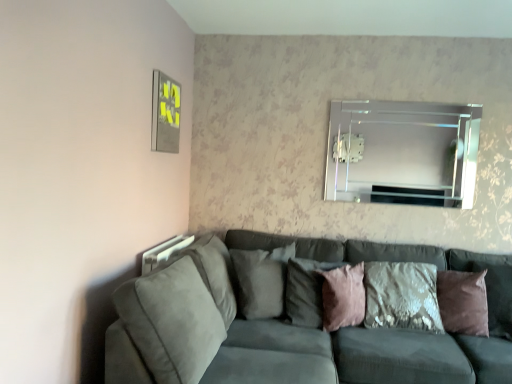
Question: Should I look upward or downward to see clear glass mirror at upper center?

Choices:
 (A) down
 (B) up

Answer: (B)

Question: Is suede gray pillow at center, the first pillow viewed from the left, wider than suede gray couch at lower left?

Choices:
 (A) no
 (B) yes

Answer: (A)

Question: Does suede gray pillow at center, the first pillow viewed from the left, have a smaller size compared to suede gray couch at lower left?

Choices:
 (A) yes
 (B) no

Answer: (A)

Question: From the image's perspective, does suede gray pillow at center, the first pillow viewed from the left, appear higher than suede gray couch at lower left?

Choices:
 (A) yes
 (B) no

Answer: (A)

Question: Is suede gray pillow at center, the fourth pillow positioned from the right, to the right of suede gray couch at lower left from the viewer's perspective?

Choices:
 (A) no
 (B) yes

Answer: (A)

Question: Could you tell me if suede gray pillow at center, the fourth pillow positioned from the right, is facing suede gray couch at lower left?

Choices:
 (A) yes
 (B) no

Answer: (A)

Question: Is suede gray pillow at center, the fourth pillow positioned from the right, not close to suede gray couch at lower left?

Choices:
 (A) no
 (B) yes

Answer: (A)

Question: Considering the relative sizes of clear glass mirror at upper center and suede gray couch at lower left in the image provided, is clear glass mirror at upper center bigger than suede gray couch at lower left?

Choices:
 (A) yes
 (B) no

Answer: (B)

Question: Can we say clear glass mirror at upper center lies outside suede gray couch at lower left?

Choices:
 (A) yes
 (B) no

Answer: (A)

Question: Does clear glass mirror at upper center have a greater width compared to suede gray couch at lower left?

Choices:
 (A) yes
 (B) no

Answer: (B)

Question: Would you consider clear glass mirror at upper center to be distant from suede gray couch at lower left?

Choices:
 (A) no
 (B) yes

Answer: (A)

Question: Considering the relative sizes of clear glass mirror at upper center and suede gray couch at lower left in the image provided, is clear glass mirror at upper center shorter than suede gray couch at lower left?

Choices:
 (A) yes
 (B) no

Answer: (A)

Question: Is clear glass mirror at upper center oriented away from suede gray couch at lower left?

Choices:
 (A) no
 (B) yes

Answer: (A)

Question: Can you see pink velvet pillow at center, marked as the third pillow in a left-to-right arrangement, touching suede gray pillow at center, the fourth pillow positioned from the right?

Choices:
 (A) yes
 (B) no

Answer: (B)